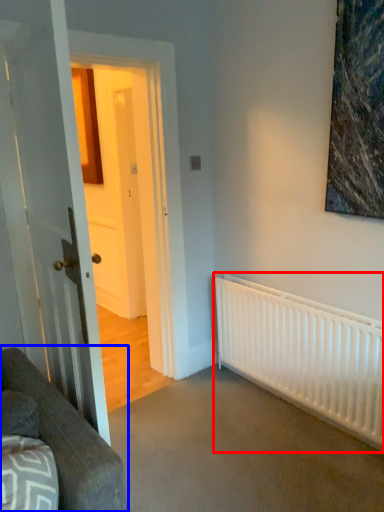
Question: Which point is further to the camera, radiator (highlighted by a red box) or studio couch (highlighted by a blue box)?

Choices:
 (A) radiator
 (B) studio couch

Answer: (A)